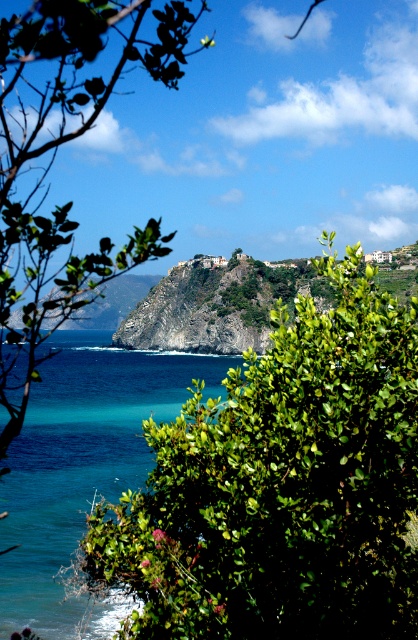
Is the position of green leafy bush at center less distant than that of green rocky cliff at center?

Yes, it is in front of green rocky cliff at center.

Does green leafy bush at center have a greater height compared to green rocky cliff at center?

Yes, green leafy bush at center is taller than green rocky cliff at center.

Between point (338, 429) and point (137, 307), which one is positioned behind?

Point (137, 307)

You are a GUI agent. You are given a task and a screenshot of the screen. Output one action in this format:
    pyautogui.click(x=<x>, y=<y>)
    Task: Click on the green leafy bush at center
    This screenshot has height=640, width=418.
    Given the screenshot: What is the action you would take?
    (x=282, y=486)

Find the location of `green leafy bush at center`. green leafy bush at center is located at coordinates (282, 486).

Does turquoise liquid at lower left appear under green rocky cliff at center?

Yes, turquoise liquid at lower left is below green rocky cliff at center.

Between turquoise liquid at lower left and green rocky cliff at center, which one is positioned higher?

green rocky cliff at center

Which is behind, point (104, 429) or point (255, 304)?

The point (255, 304) is behind.

Where is `turquoise liquid at lower left`? turquoise liquid at lower left is located at coordinates (83, 468).